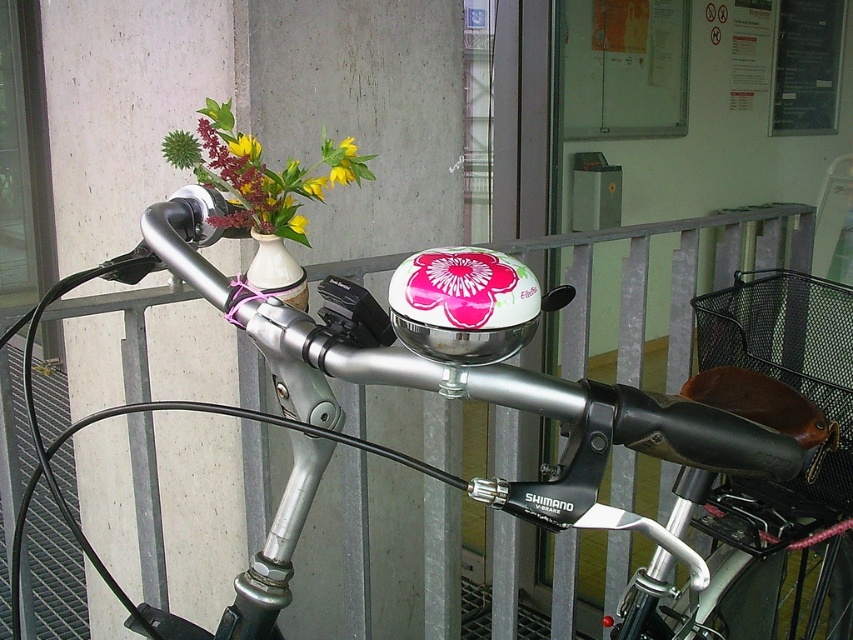
Find the location of a particular element. Image resolution: width=853 pixels, height=640 pixels. white matte vase at upper center is located at coordinates (276, 272).

Does white matte vase at upper center appear on the right side of yellow matte flower at center?

Incorrect, white matte vase at upper center is not on the right side of yellow matte flower at center.

Between point (277, 278) and point (300, 228), which one is positioned behind?

Point (300, 228)

Image resolution: width=853 pixels, height=640 pixels. Identify the location of white matte vase at upper center. (276, 272).

Is matte ceramic vase at upper left wider than floral print helmet at center?

Correct, the width of matte ceramic vase at upper left exceeds that of floral print helmet at center.

Who is more distant from viewer, (287, 182) or (469, 246)?

Point (287, 182)

At what (x,y) coordinates should I click in order to perform the action: click on matte ceramic vase at upper left. Please return your answer as a coordinate pair (x, y). This screenshot has width=853, height=640. Looking at the image, I should click on (258, 173).

Can you confirm if matte ceramic vase at upper left is positioned above yellow matte flower at center?

Yes, matte ceramic vase at upper left is above yellow matte flower at center.

Locate an element on the screen. Image resolution: width=853 pixels, height=640 pixels. matte ceramic vase at upper left is located at coordinates (258, 173).

Between point (344, 180) and point (294, 230), which one is positioned behind?

Positioned behind is point (344, 180).

Locate an element on the screen. matte ceramic vase at upper left is located at coordinates (258, 173).